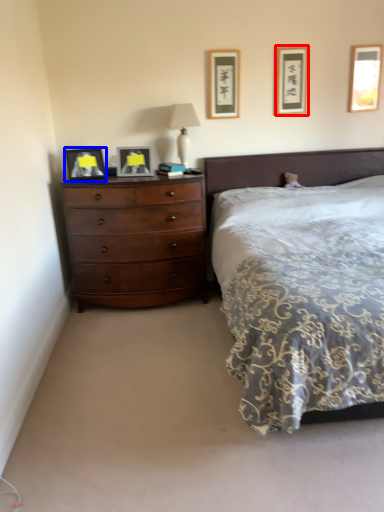
Question: Which of the following is the closest to the observer, picture frame (highlighted by a red box) or picture frame (highlighted by a blue box)?

Choices:
 (A) picture frame
 (B) picture frame

Answer: (B)